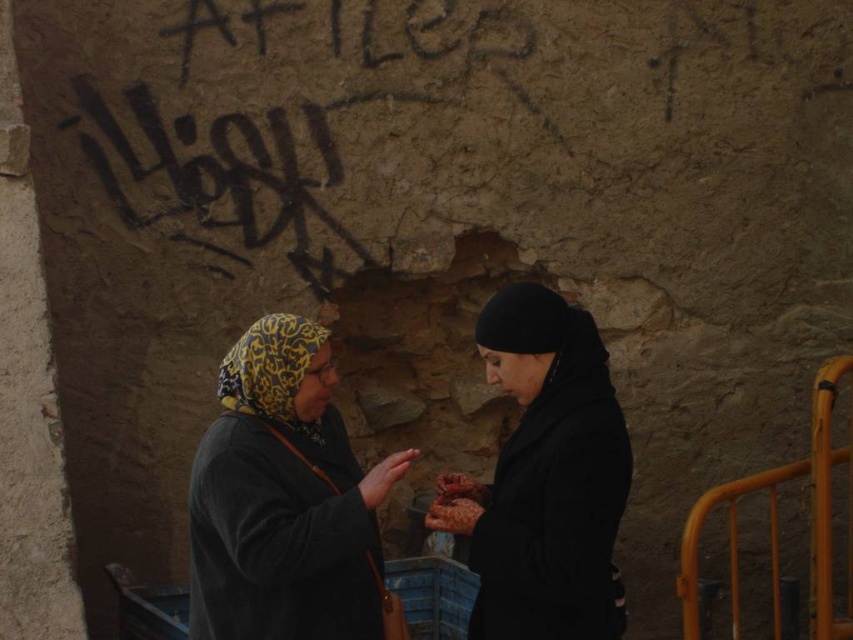
Question: Is yellow printed headscarf at center to the left of black matte coat at center from the viewer's perspective?

Choices:
 (A) no
 (B) yes

Answer: (B)

Question: Is yellow printed headscarf at center in front of black matte coat at center?

Choices:
 (A) no
 (B) yes

Answer: (A)

Question: Which object appears farthest from the camera in this image?

Choices:
 (A) black matte coat at center
 (B) yellow printed headscarf at center

Answer: (B)

Question: Which point is farther from the camera taking this photo?

Choices:
 (A) (258, 371)
 (B) (457, 513)

Answer: (A)

Question: Is yellow printed headscarf at center below black matte coat at center?

Choices:
 (A) yes
 (B) no

Answer: (A)